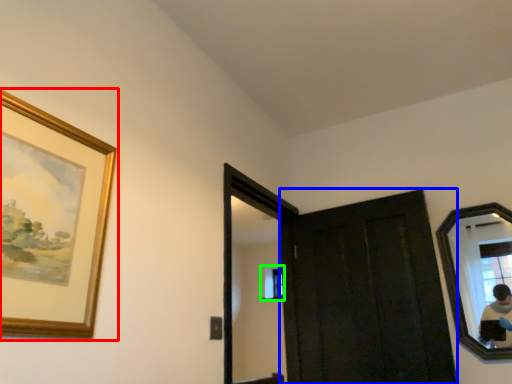
Question: Estimate the real-world distances between objects in this image. Which object is farther from picture frame (highlighted by a red box), door (highlighted by a blue box) or window (highlighted by a green box)?

Choices:
 (A) door
 (B) window

Answer: (B)